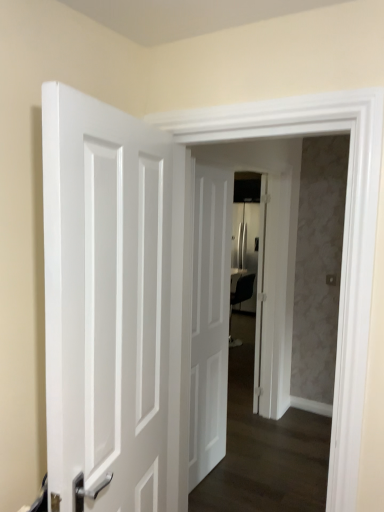
Measure the distance between point (46, 153) and camera.

The distance of point (46, 153) from camera is 36.97 inches.

What do you see at coordinates (210, 320) in the screenshot?
I see `white matte door at center, the second door in the front-to-back sequence` at bounding box center [210, 320].

At what (x,y) coordinates should I click in order to perform the action: click on white glossy door at left, the first door when ordered from front to back. Please return your answer as a coordinate pair (x, y). The image size is (384, 512). Looking at the image, I should click on (108, 302).

Can you confirm if white glossy door at center, the third door in the front-to-back sequence, is wider than white glossy door at left, placed as the third door when sorted from right to left?

In fact, white glossy door at center, the third door in the front-to-back sequence, might be narrower than white glossy door at left, placed as the third door when sorted from right to left.

What's the angular difference between white glossy door at center, the third door in the front-to-back sequence, and white glossy door at left, the first door when ordered from front to back,'s facing directions?

The angular difference between white glossy door at center, the third door in the front-to-back sequence, and white glossy door at left, the first door when ordered from front to back, is 175 degrees.

Is white glossy door at center, the third door in the front-to-back sequence, to the left or to the right of white glossy door at left, the first door when ordered from front to back, in the image?

In the image, white glossy door at center, the third door in the front-to-back sequence, appears on the right side of white glossy door at left, the first door when ordered from front to back.

Can white glossy door at left, the third door when ordered from back to front, be found inside white glossy door at center, the third door in the front-to-back sequence?

Actually, white glossy door at left, the third door when ordered from back to front, is outside white glossy door at center, the third door in the front-to-back sequence.

Which object is more forward, white matte door at center, placed as the second door when sorted from back to front, or white glossy door at center?

white glossy door at center is closer to the camera.

Considering the relative sizes of white matte door at center, the second door in the front-to-back sequence, and white glossy door at center in the image provided, is white matte door at center, the second door in the front-to-back sequence, wider than white glossy door at center?

No.

Does point (208, 459) appear closer or farther from the camera than point (293, 252)?

Point (208, 459) appears to be closer to the viewer than point (293, 252).

Is white matte door at center, placed as the second door when sorted from right to left, positioned with its back to white glossy door at center?

Yes.

Who is shorter, white glossy door at center or white glossy door at center, the first door when ordered from right to left?

white glossy door at center, the first door when ordered from right to left.

Considering the sizes of objects white glossy door at center and white glossy door at center, positioned as the third door in left-to-right order, in the image provided, who is smaller, white glossy door at center or white glossy door at center, positioned as the third door in left-to-right order,?

With smaller size is white glossy door at center, positioned as the third door in left-to-right order.

Which is in front, white glossy door at center or white glossy door at center, the first door when ordered from right to left?

white glossy door at center.

Is white glossy door at left, marked as the first door in a left-to-right arrangement, not close to white matte door at center, placed as the second door when sorted from back to front?

white glossy door at left, marked as the first door in a left-to-right arrangement, is positioned a significant distance from white matte door at center, placed as the second door when sorted from back to front.

Is white glossy door at left, the third door when ordered from back to front, closer to camera compared to white matte door at center, positioned as the 2th door in left-to-right order?

Yes.

Is white glossy door at left, the third door when ordered from back to front, facing away from white matte door at center, placed as the second door when sorted from right to left?

white glossy door at left, the third door when ordered from back to front, is not turned away from white matte door at center, placed as the second door when sorted from right to left.

From a real-world perspective, is white glossy door at left, marked as the first door in a left-to-right arrangement, located beneath white matte door at center, the second door in the front-to-back sequence?

No, from a real-world perspective, white glossy door at left, marked as the first door in a left-to-right arrangement, is not below white matte door at center, the second door in the front-to-back sequence.

Is point (230, 245) positioned before point (142, 355)?

No.

Between white matte door at center, the second door in the front-to-back sequence, and white glossy door at left, the first door when ordered from front to back, which one is positioned in front?

white glossy door at left, the first door when ordered from front to back, is closer to the camera.

Locate an element on the screen. door to the left of white matte door at center, placed as the second door when sorted from back to front is located at coordinates (108, 302).

Visually, is white matte door at center, placed as the second door when sorted from right to left, positioned to the left or to the right of white glossy door at left, the first door when ordered from front to back?

white matte door at center, placed as the second door when sorted from right to left, is positioned on white glossy door at left, the first door when ordered from front to back,'s right side.

Find the location of a particular element. The image size is (384, 512). door that is the 2nd one when counting downward from the white glossy door at center, placed as the first door when sorted from back to front (from the image's perspective) is located at coordinates (210, 320).

Considering the relative sizes of white glossy door at center, positioned as the third door in left-to-right order, and white matte door at center, the second door in the front-to-back sequence, in the image provided, is white glossy door at center, positioned as the third door in left-to-right order, smaller than white matte door at center, the second door in the front-to-back sequence,?

Indeed, white glossy door at center, positioned as the third door in left-to-right order, has a smaller size compared to white matte door at center, the second door in the front-to-back sequence.

Based on the photo, which object is more forward, white glossy door at center, positioned as the third door in left-to-right order, or white matte door at center, the second door in the front-to-back sequence?

white matte door at center, the second door in the front-to-back sequence, is more forward.

Between point (260, 247) and point (229, 211), which one is positioned in front?

The point (229, 211) is in front.

Consider the image. Which of these two, white glossy door at center, placed as the first door when sorted from back to front, or white glossy door at center, stands shorter?

Standing shorter between the two is white glossy door at center, placed as the first door when sorted from back to front.

From a real-world perspective, is white glossy door at center, placed as the first door when sorted from back to front, positioned above or below white glossy door at center?

white glossy door at center, placed as the first door when sorted from back to front, is below white glossy door at center.

Is white glossy door at center, positioned as the third door in left-to-right order, positioned with its back to white glossy door at center?

Correct, white glossy door at center, positioned as the third door in left-to-right order, is looking away from white glossy door at center.

From the image's perspective, is white glossy door at center, positioned as the third door in left-to-right order, above or below white glossy door at center?

white glossy door at center, positioned as the third door in left-to-right order, is above white glossy door at center.

From a real-world perspective, count 1st doors downward from the white glossy door at left, placed as the third door when sorted from right to left, and point to it. Please provide its 2D coordinates.

[(260, 293)]

In the image, there is a white glossy door at center. Identify the location of door below it (from the image's perspective). (210, 320).

Which object lies nearer to the anchor point white glossy door at center, the third door in the front-to-back sequence, white matte door at center, the second door in the front-to-back sequence, or white glossy door at center?

white glossy door at center.

Considering their positions, is white glossy door at center positioned closer to white glossy door at center, the first door when ordered from right to left, than white matte door at center, placed as the second door when sorted from right to left?

white glossy door at center.

Looking at the image, which one is located further to white matte door at center, positioned as the 2th door in left-to-right order, white glossy door at center, the first door when ordered from right to left, or white glossy door at center?

Among the two, white glossy door at center, the first door when ordered from right to left, is located further to white matte door at center, positioned as the 2th door in left-to-right order.

Which object lies further to the anchor point white glossy door at left, marked as the first door in a left-to-right arrangement, white glossy door at center, positioned as the third door in left-to-right order, or white matte door at center, positioned as the 2th door in left-to-right order?

Based on the image, white glossy door at center, positioned as the third door in left-to-right order, appears to be further to white glossy door at left, marked as the first door in a left-to-right arrangement.

When comparing their distances from white matte door at center, the second door in the front-to-back sequence, does white glossy door at center or white glossy door at center, the first door when ordered from right to left, seem further?

white glossy door at center, the first door when ordered from right to left, lies further to white matte door at center, the second door in the front-to-back sequence, than the other object.

Considering their positions, is white matte door at center, the second door in the front-to-back sequence, positioned further to white glossy door at center than white glossy door at left, marked as the first door in a left-to-right arrangement?

white glossy door at left, marked as the first door in a left-to-right arrangement.

From the image, which object appears to be farther from white glossy door at left, marked as the first door in a left-to-right arrangement, white glossy door at center or white glossy door at center, positioned as the third door in left-to-right order?

white glossy door at center, positioned as the third door in left-to-right order, lies further to white glossy door at left, marked as the first door in a left-to-right arrangement, than the other object.

Based on their spatial positions, is white matte door at center, positioned as the 2th door in left-to-right order, or white glossy door at left, marked as the first door in a left-to-right arrangement, closer to white glossy door at center, the third door in the front-to-back sequence?

white matte door at center, positioned as the 2th door in left-to-right order, lies closer to white glossy door at center, the third door in the front-to-back sequence, than the other object.

The image size is (384, 512). Identify the location of door between white glossy door at left, placed as the third door when sorted from right to left, and white glossy door at center, positioned as the third door in left-to-right order, along the z-axis. (210, 320).

Image resolution: width=384 pixels, height=512 pixels. Identify the location of screen door located between white glossy door at left, the third door when ordered from back to front, and white matte door at center, placed as the second door when sorted from back to front, in the depth direction. (229, 290).

Identify the location of door located between white glossy door at center and white glossy door at center, placed as the first door when sorted from back to front, in the depth direction. The height and width of the screenshot is (512, 384). (210, 320).

This screenshot has height=512, width=384. I want to click on screen door located between white glossy door at left, the first door when ordered from front to back, and white glossy door at center, positioned as the third door in left-to-right order, in the depth direction, so click(229, 290).